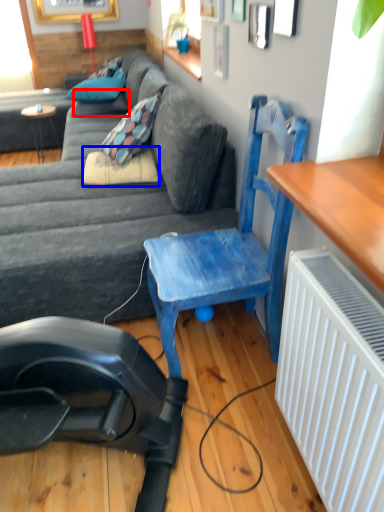
Question: Among these objects, which one is nearest to the camera, pillow (highlighted by a red box) or pillow (highlighted by a blue box)?

Choices:
 (A) pillow
 (B) pillow

Answer: (B)